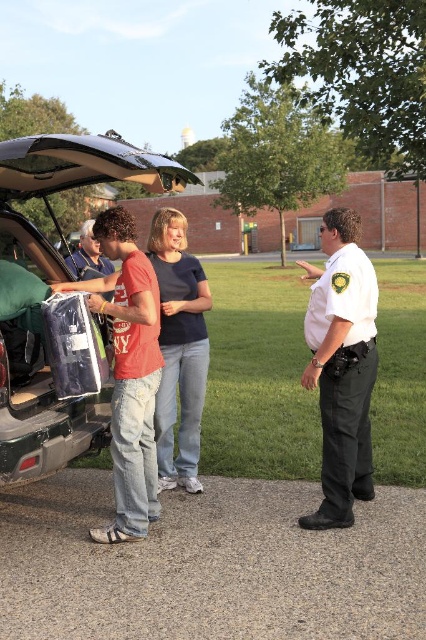
Is metallic silver car at center above white uniform at right?

Yes.

Which of these two, metallic silver car at center or white uniform at right, stands shorter?

metallic silver car at center is shorter.

Identify the location of metallic silver car at center. (57, 310).

Locate an element on the screen. Image resolution: width=426 pixels, height=640 pixels. metallic silver car at center is located at coordinates (57, 310).

Which is above, white uniform at right or blue cotton shirt at center?

blue cotton shirt at center

Who is shorter, white uniform at right or blue cotton shirt at center?

With less height is white uniform at right.

Measure the distance between white uniform at right and camera.

The distance of white uniform at right from camera is 4.00 meters.

This screenshot has height=640, width=426. I want to click on white uniform at right, so click(x=342, y=365).

Does metallic silver car at center have a lesser height compared to blue cotton shirt at center?

Yes.

Does point (32, 225) lie in front of point (199, 320)?

That is False.

Is point (54, 253) positioned after point (203, 342)?

Yes, point (54, 253) is farther from viewer.

The width and height of the screenshot is (426, 640). Find the location of `metallic silver car at center`. metallic silver car at center is located at coordinates (57, 310).